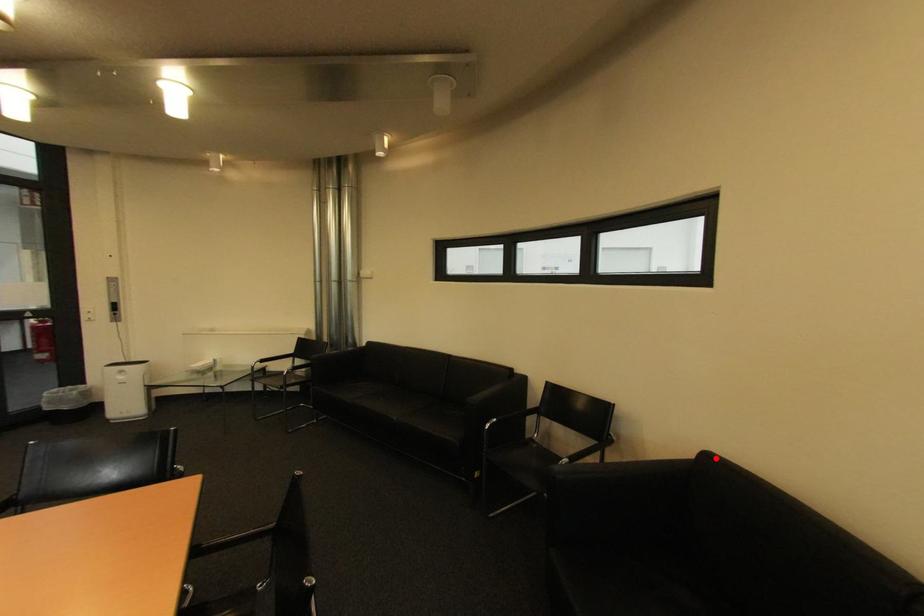
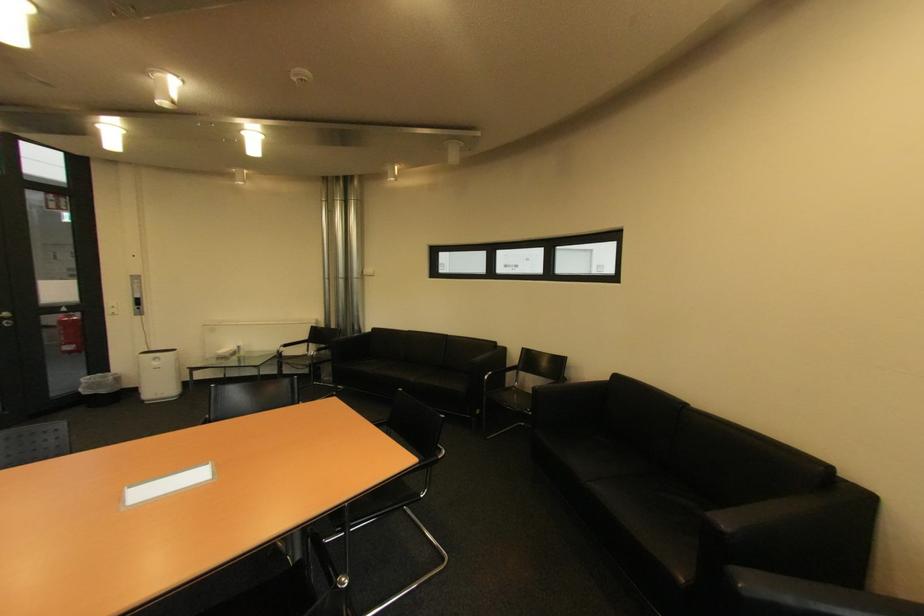
The point at the highlighted location is marked in the first image. Where is the corresponding point in the second image?

(625, 378)